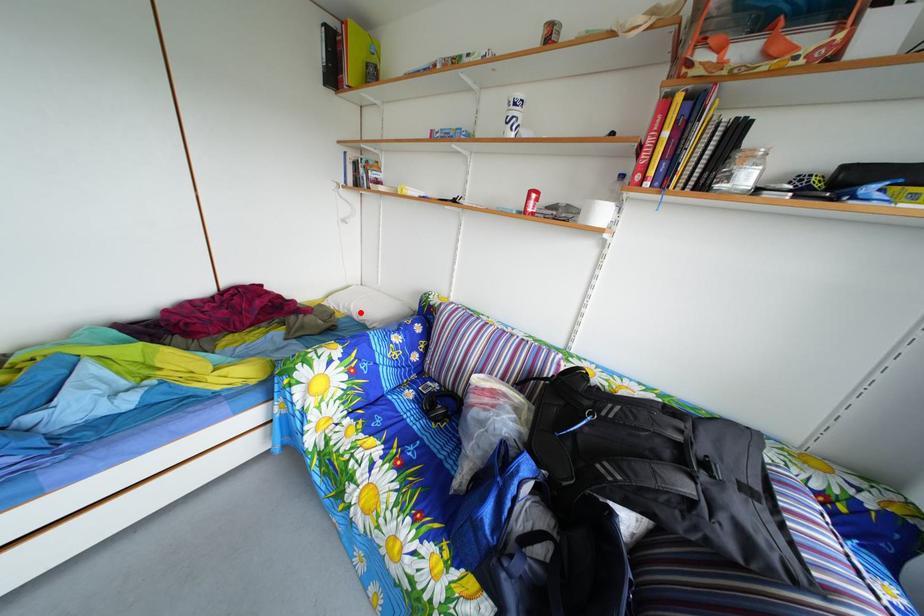
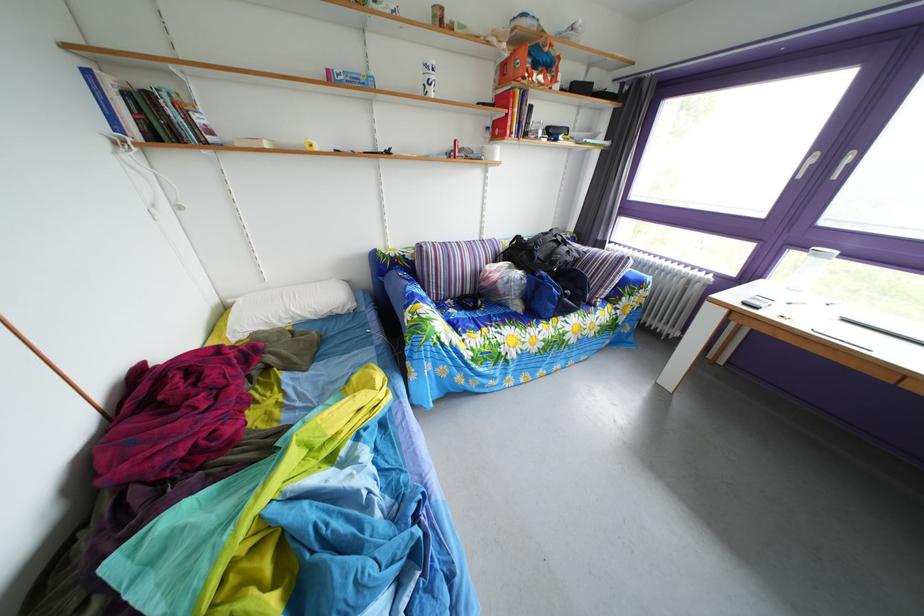
In the second image, find the point that corresponds to the highlighted location in the first image.

(298, 320)